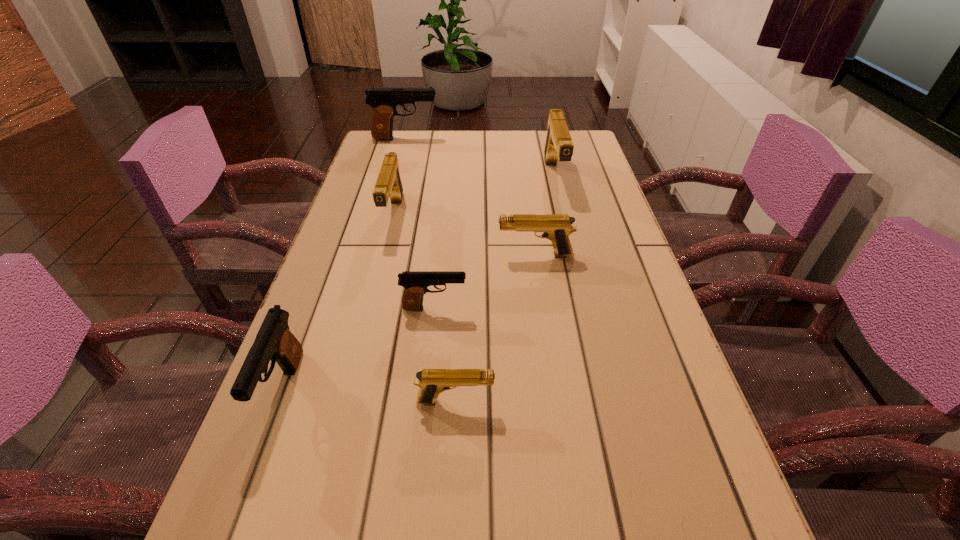
Locate an element on the screen. object present at the far left corner is located at coordinates (384, 100).

The height and width of the screenshot is (540, 960). Find the location of `object present at the far right corner`. object present at the far right corner is located at coordinates (558, 145).

Find the location of a particular element. The image size is (960, 540). vacant space at the far edge is located at coordinates (444, 150).

Where is `free space at the left edge of the desktop`? free space at the left edge of the desktop is located at coordinates (x=357, y=221).

This screenshot has height=540, width=960. Find the location of `vacant position at the right edge of the desktop`. vacant position at the right edge of the desktop is located at coordinates tap(580, 185).

The height and width of the screenshot is (540, 960). In the image, there is a desktop. In order to click on free space at the far left corner in this screenshot , I will do `click(395, 131)`.

Image resolution: width=960 pixels, height=540 pixels. I want to click on free space between the smallest black pistol and the nearest black pistol, so click(359, 349).

This screenshot has width=960, height=540. I want to click on vacant point located between the second biggest black pistol and the fifth farthest object, so click(359, 349).

Where is `vacant area that lies between the farthest object and the second smallest tan pistol`? Image resolution: width=960 pixels, height=540 pixels. vacant area that lies between the farthest object and the second smallest tan pistol is located at coordinates (470, 197).

Identify the location of empty space that is in between the smallest tan pistol and the biggest tan pistol. (504, 289).